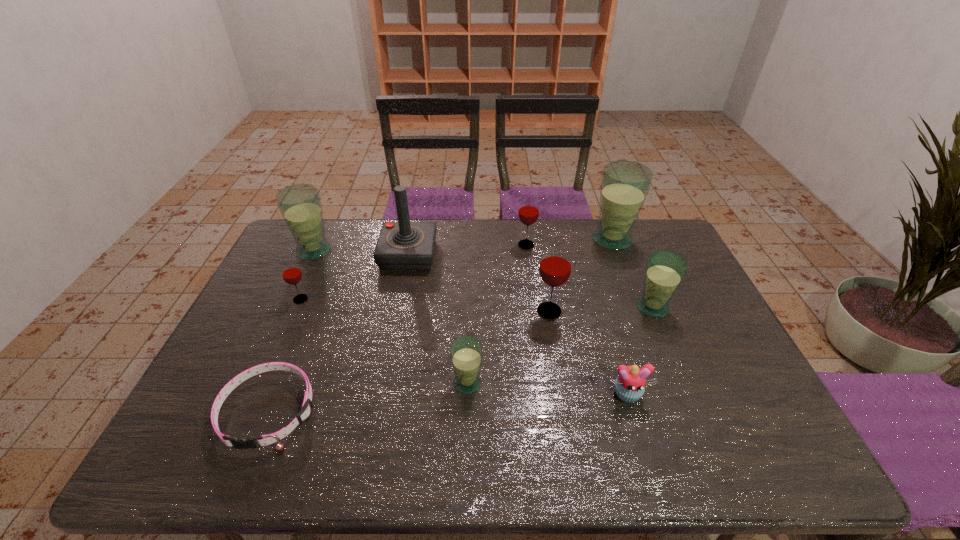
This screenshot has width=960, height=540. Find the location of `the tallest glass`. the tallest glass is located at coordinates (625, 185).

Where is `the fourth object from left to right`? the fourth object from left to right is located at coordinates (403, 245).

You are a GUI agent. You are given a task and a screenshot of the screen. Output one action in this format:
    pyautogui.click(x=<x>, y=<y>)
    Task: Click on the red joystick
    Image resolution: width=960 pixels, height=540 pixels.
    Given the screenshot: What is the action you would take?
    pyautogui.click(x=403, y=245)

Locate an element on the screen. the third smallest blue glass is located at coordinates (300, 205).

Where is `the biggest red glass`? the biggest red glass is located at coordinates (555, 267).

I want to click on the farthest red glass, so click(528, 213).

Where is `the second nearest blue glass`? The image size is (960, 540). the second nearest blue glass is located at coordinates (665, 270).

Identify the location of the leftmost red glass. (291, 273).

The height and width of the screenshot is (540, 960). Find the location of `the nearest glass`. the nearest glass is located at coordinates (466, 352).

Identify the location of the third glass from left to right. (466, 352).